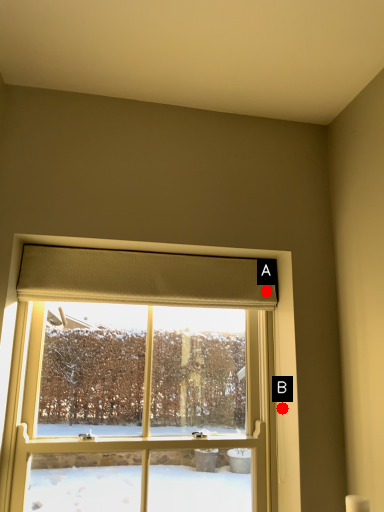
Question: Two points are circled on the image, labeled by A and B beside each circle. Which point is closer to the camera?

Choices:
 (A) A is closer
 (B) B is closer

Answer: (B)